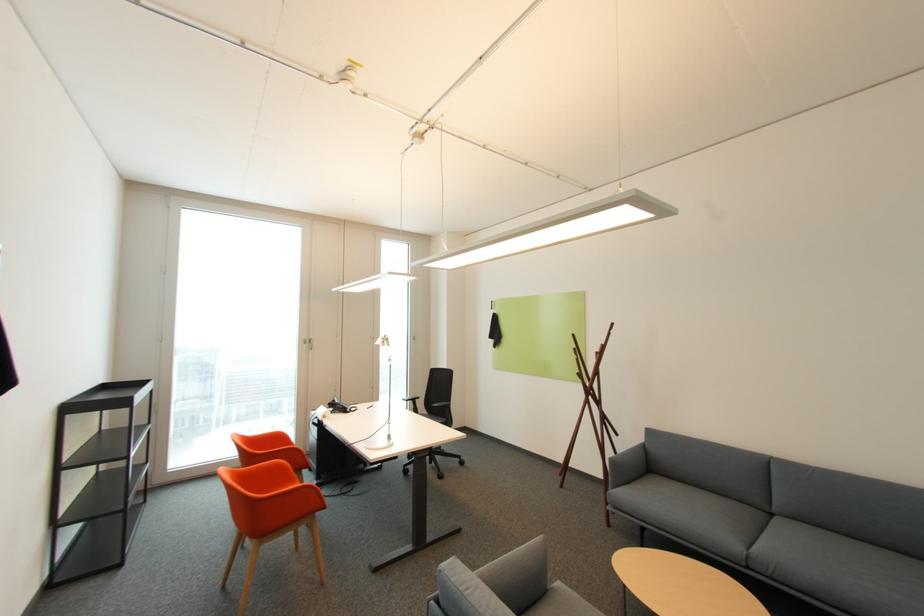
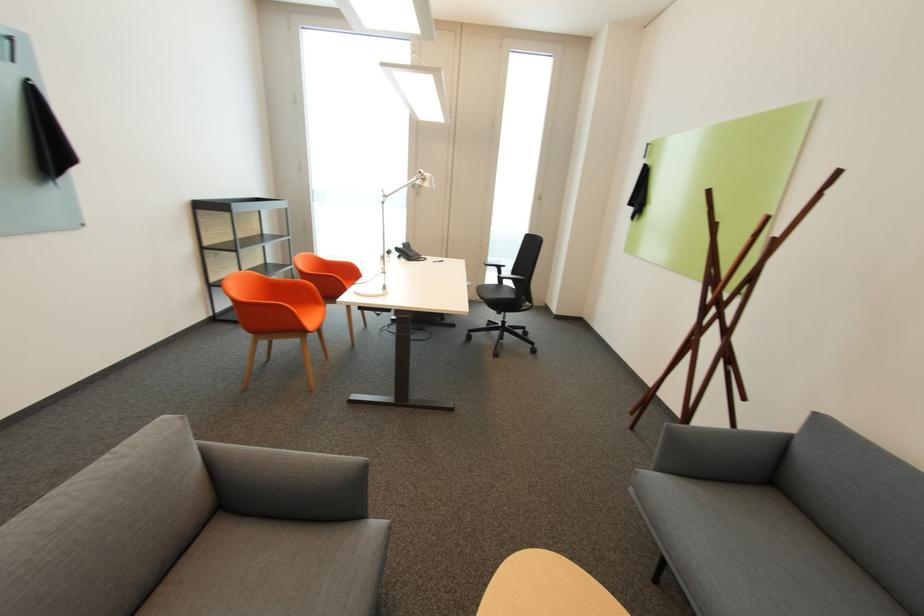
Where in the second image is the point corresponding to pixel 418 402 from the first image?

(503, 269)